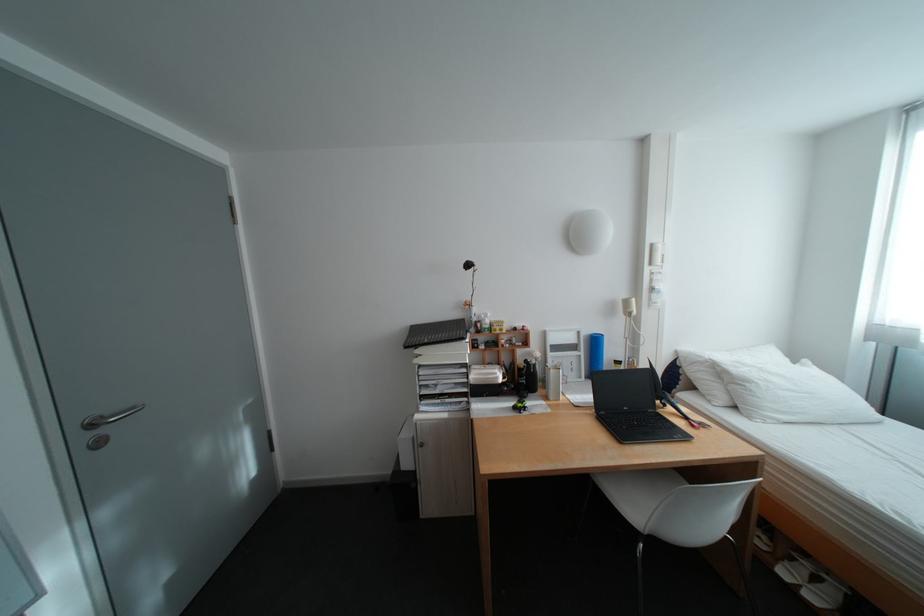
The width and height of the screenshot is (924, 616). In order to click on cabinet door handle in this screenshot , I will do `click(99, 421)`.